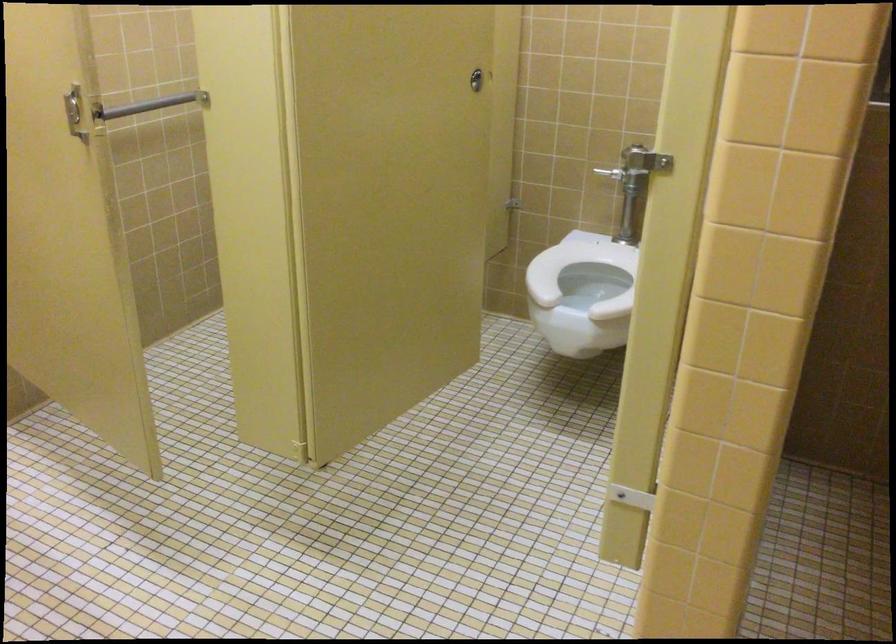
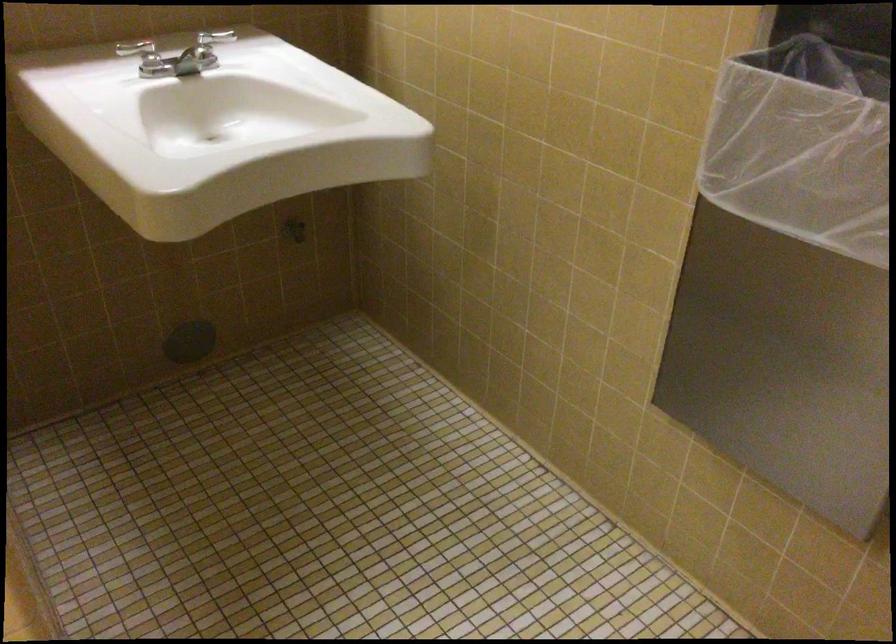
How did the camera likely rotate?

The rotation direction of the camera is right-down.